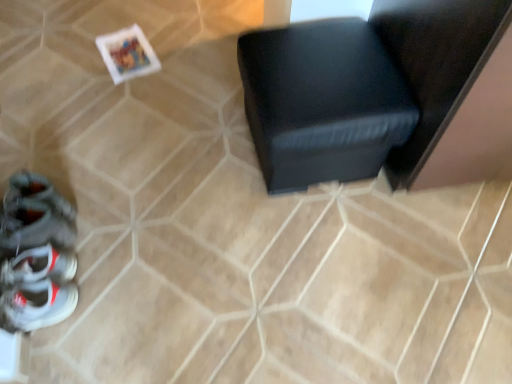
Question: Is the position of white leather sneakers at lower left more distant than that of black leather ottoman at center?

Choices:
 (A) no
 (B) yes

Answer: (A)

Question: Is white leather sneakers at lower left not inside black leather ottoman at center?

Choices:
 (A) no
 (B) yes

Answer: (B)

Question: Is white leather sneakers at lower left bigger than black leather ottoman at center?

Choices:
 (A) yes
 (B) no

Answer: (B)

Question: Considering the relative sizes of white leather sneakers at lower left and black leather ottoman at center in the image provided, is white leather sneakers at lower left shorter than black leather ottoman at center?

Choices:
 (A) yes
 (B) no

Answer: (A)

Question: From a real-world perspective, is white leather sneakers at lower left located beneath black leather ottoman at center?

Choices:
 (A) no
 (B) yes

Answer: (B)

Question: From their relative heights in the image, would you say black leather ottoman at center is taller or shorter than shiny gray sneaker at lower left?

Choices:
 (A) short
 (B) tall

Answer: (B)

Question: Relative to shiny gray sneaker at lower left, is black leather ottoman at center in front or behind?

Choices:
 (A) front
 (B) behind

Answer: (A)

Question: From a real-world perspective, is black leather ottoman at center positioned above or below shiny gray sneaker at lower left?

Choices:
 (A) below
 (B) above

Answer: (B)

Question: Considering the positions of black leather ottoman at center and shiny gray sneaker at lower left in the image, is black leather ottoman at center wider or thinner than shiny gray sneaker at lower left?

Choices:
 (A) thin
 (B) wide

Answer: (B)

Question: Is shiny gray sneaker at lower left wider or thinner than white leather sneakers at lower left?

Choices:
 (A) wide
 (B) thin

Answer: (B)

Question: Considering the positions of shiny gray sneaker at lower left and white leather sneakers at lower left in the image, is shiny gray sneaker at lower left bigger or smaller than white leather sneakers at lower left?

Choices:
 (A) small
 (B) big

Answer: (B)

Question: Considering the positions of shiny gray sneaker at lower left and white leather sneakers at lower left in the image, is shiny gray sneaker at lower left taller or shorter than white leather sneakers at lower left?

Choices:
 (A) short
 (B) tall

Answer: (B)

Question: From a real-world perspective, is shiny gray sneaker at lower left positioned above or below white leather sneakers at lower left?

Choices:
 (A) above
 (B) below

Answer: (A)

Question: Is shiny gray sneaker at lower left taller or shorter than black leather ottoman at center?

Choices:
 (A) tall
 (B) short

Answer: (B)

Question: Is shiny gray sneaker at lower left in front of or behind black leather ottoman at center in the image?

Choices:
 (A) front
 (B) behind

Answer: (B)